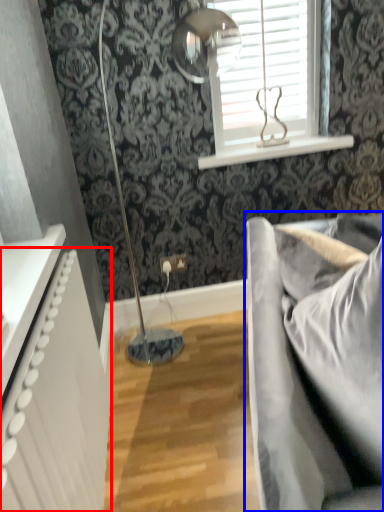
Question: Which object appears farthest to the camera in this image, radiator (highlighted by a red box) or studio couch (highlighted by a blue box)?

Choices:
 (A) radiator
 (B) studio couch

Answer: (A)